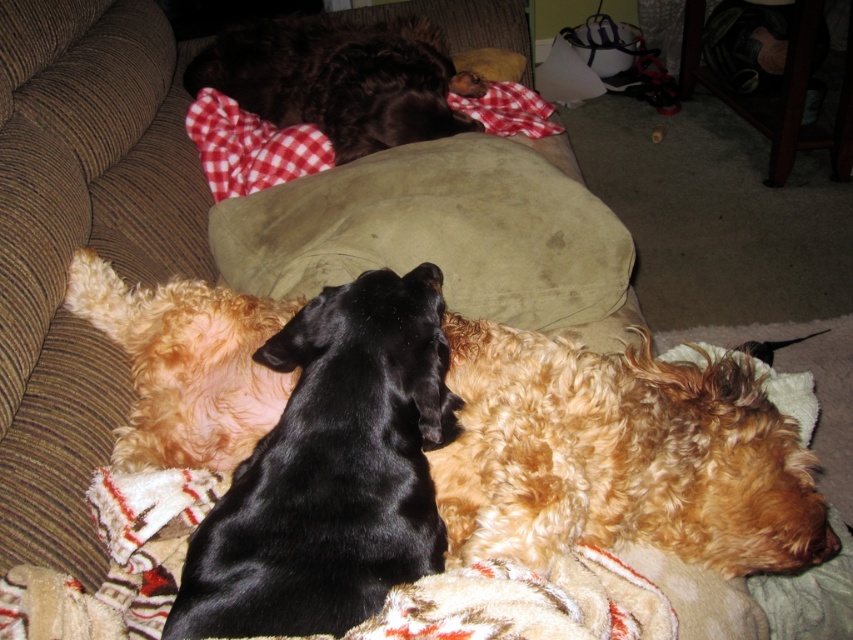
You are sitting on the couch and see the black smooth dog at center and the suede cushion at center. Which one is closer to your left side?

The black smooth dog at center is closer to your left side since it is positioned to the left of the suede cushion at center.

You are a photographer wanting to capture a clear shot of the black smooth dog at center. However, the shiny brown fur at center is blocking your view. Can you adjust your position to take the photo without moving any dogs?

The black smooth dog at center is positioned under the shiny brown fur at center, so you can lower your camera angle to take the photo without moving any dogs.